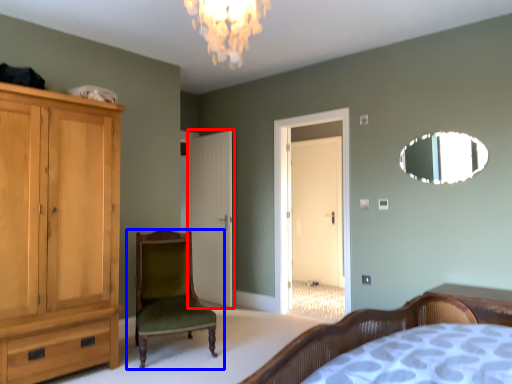
Question: Which of the following is the farthest to the observer, door (highlighted by a red box) or chair (highlighted by a blue box)?

Choices:
 (A) door
 (B) chair

Answer: (A)